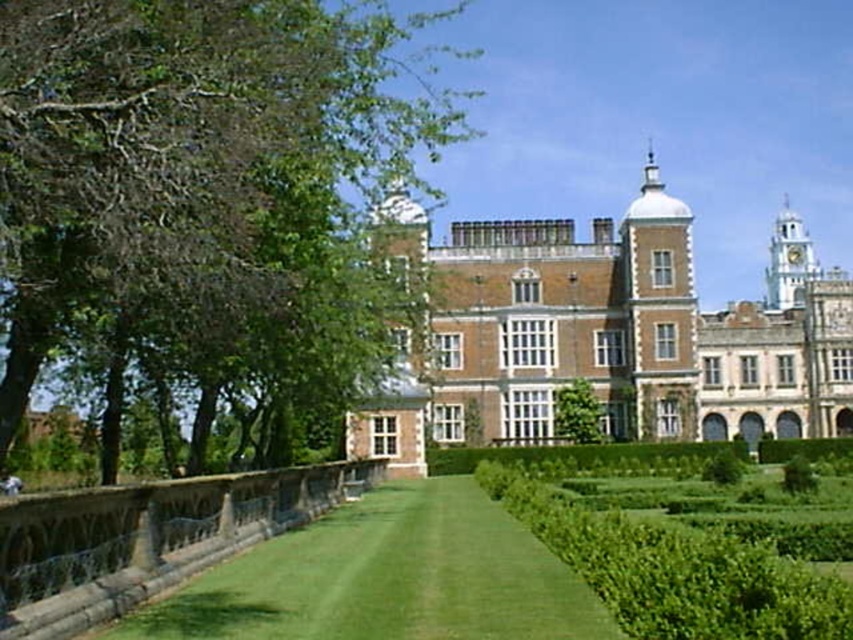
Question: Which of these objects is positioned closest to the brown brick palace at center?

Choices:
 (A) green grass at center
 (B) green leafy tree at upper left
 (C) green leafy hedge at center

Answer: (A)

Question: Which point is closer to the camera?

Choices:
 (A) (503, 474)
 (B) (158, 346)
 (C) (656, 317)

Answer: (B)

Question: Where is green leafy tree at upper left located in relation to green grass at center in the image?

Choices:
 (A) left
 (B) right

Answer: (A)

Question: Is green leafy tree at upper left positioned in front of green leafy hedge at center?

Choices:
 (A) no
 (B) yes

Answer: (A)

Question: Does green leafy tree at upper left have a greater width compared to brown brick palace at center?

Choices:
 (A) no
 (B) yes

Answer: (A)

Question: Which point appears farthest from the camera in this image?

Choices:
 (A) (132, 264)
 (B) (219, 588)

Answer: (B)